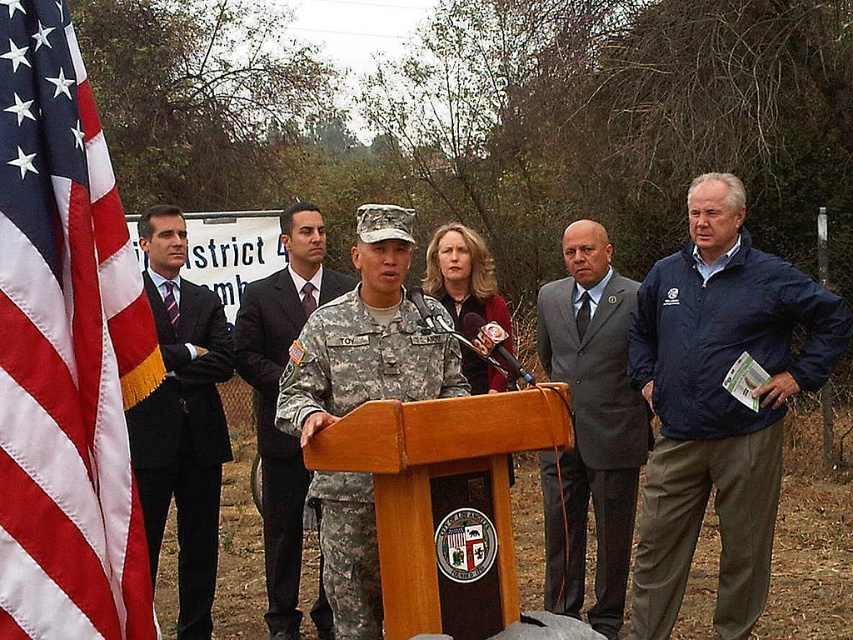
Is black suit at left above camouflage uniform at center?

Yes.

Which is behind, point (209, 294) or point (248, 314)?

The point (209, 294) is behind.

You are a GUI agent. You are given a task and a screenshot of the screen. Output one action in this format:
    pyautogui.click(x=<x>, y=<y>)
    Task: Click on the black suit at left
    The width and height of the screenshot is (853, 640).
    Given the screenshot: What is the action you would take?
    pyautogui.click(x=183, y=419)

Does red-white striped flag at left appear under camouflage uniform at center?

No, red-white striped flag at left is not below camouflage uniform at center.

Which is more to the right, red-white striped flag at left or camouflage uniform at center?

camouflage uniform at center is more to the right.

Who is more forward, (x=12, y=147) or (x=283, y=305)?

Positioned in front is point (x=12, y=147).

In order to click on red-white striped flag at left in this screenshot , I will do `click(65, 349)`.

Is red-white striped flag at left to the left of blue fabric jacket at right from the viewer's perspective?

Yes, red-white striped flag at left is to the left of blue fabric jacket at right.

Does point (57, 266) lie in front of point (701, 454)?

Yes, it is in front of point (701, 454).

Find the location of a particular element. This screenshot has width=853, height=640. red-white striped flag at left is located at coordinates point(65,349).